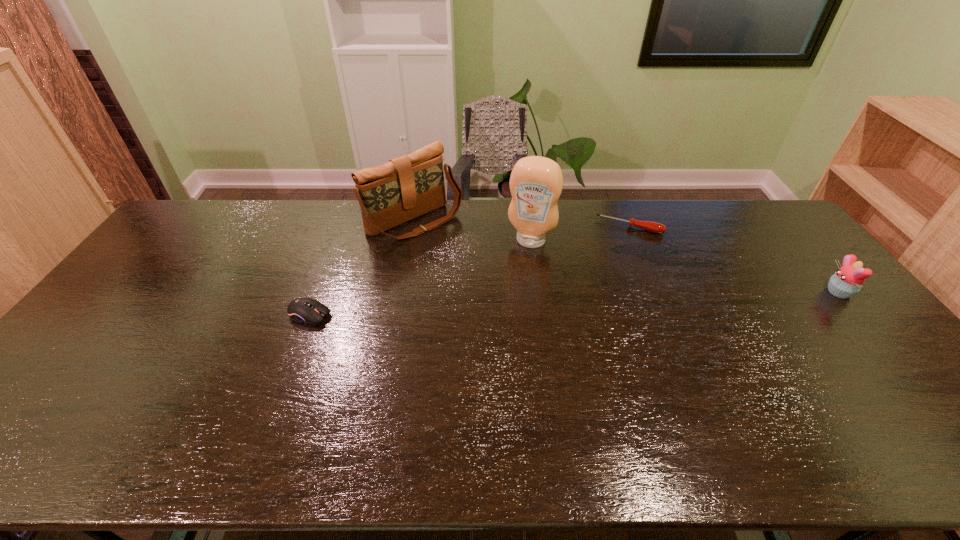
Find the location of `the leftmost object`. the leftmost object is located at coordinates (302, 310).

You are a GUI agent. You are given a task and a screenshot of the screen. Output one action in this format:
    pyautogui.click(x=<x>, y=<y>)
    Task: Click on the fourth tallest object
    The height and width of the screenshot is (540, 960).
    Given the screenshot: What is the action you would take?
    pyautogui.click(x=302, y=310)

Locate an element on the screen. This screenshot has height=540, width=960. cupcake is located at coordinates (847, 281).

You are a GUI agent. You are given a task and a screenshot of the screen. Output one action in this format:
    pyautogui.click(x=<x>, y=<y>)
    Task: Click on the third shortest object
    The width and height of the screenshot is (960, 540).
    Given the screenshot: What is the action you would take?
    pyautogui.click(x=847, y=281)

Locate an element on the screen. This screenshot has width=960, height=540. the fourth object from right to left is located at coordinates (406, 187).

At what (x,y) coordinates should I click in order to perform the action: click on the fourth shortest object. Please return your answer as a coordinate pair (x, y). The image size is (960, 540). Looking at the image, I should click on (406, 187).

Where is `the shortest object`? This screenshot has height=540, width=960. the shortest object is located at coordinates (654, 227).

Where is `screwdriver`? screwdriver is located at coordinates (654, 227).

The height and width of the screenshot is (540, 960). Find the location of `the third object from right to left`. the third object from right to left is located at coordinates (536, 182).

Locate an element on the screen. The height and width of the screenshot is (540, 960). condiment is located at coordinates (536, 182).